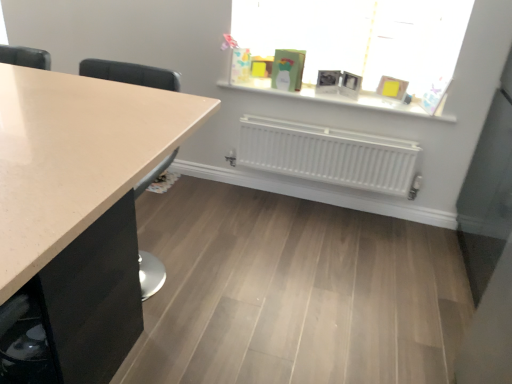
Question: Is white matte window sill at upper center not close to matte glass window at upper center?

Choices:
 (A) no
 (B) yes

Answer: (A)

Question: Can you confirm if white matte window sill at upper center is shorter than matte glass window at upper center?

Choices:
 (A) yes
 (B) no

Answer: (A)

Question: Can you confirm if white matte window sill at upper center is positioned to the left of matte glass window at upper center?

Choices:
 (A) yes
 (B) no

Answer: (A)

Question: From the image's perspective, would you say white matte window sill at upper center is positioned over matte glass window at upper center?

Choices:
 (A) yes
 (B) no

Answer: (B)

Question: Is the position of white matte window sill at upper center less distant than that of matte glass window at upper center?

Choices:
 (A) yes
 (B) no

Answer: (B)

Question: In terms of width, does white matte window sill at upper center look wider or thinner when compared to matte beige countertop at left?

Choices:
 (A) wide
 (B) thin

Answer: (B)

Question: Based on their sizes in the image, would you say white matte window sill at upper center is bigger or smaller than matte beige countertop at left?

Choices:
 (A) small
 (B) big

Answer: (A)

Question: Choose the correct answer: Is white matte window sill at upper center inside matte beige countertop at left or outside it?

Choices:
 (A) outside
 (B) inside

Answer: (A)

Question: From their relative heights in the image, would you say white matte window sill at upper center is taller or shorter than matte beige countertop at left?

Choices:
 (A) short
 (B) tall

Answer: (A)

Question: Relative to matte glass window at upper center, is matte beige countertop at left in front or behind?

Choices:
 (A) front
 (B) behind

Answer: (A)

Question: From the image's perspective, is matte beige countertop at left positioned above or below matte glass window at upper center?

Choices:
 (A) below
 (B) above

Answer: (A)

Question: From a real-world perspective, is matte beige countertop at left positioned above or below matte glass window at upper center?

Choices:
 (A) above
 (B) below

Answer: (B)

Question: From their relative heights in the image, would you say matte beige countertop at left is taller or shorter than matte glass window at upper center?

Choices:
 (A) tall
 (B) short

Answer: (A)

Question: Is matte glass window at upper center taller or shorter than white matte radiator at center?

Choices:
 (A) tall
 (B) short

Answer: (A)

Question: In terms of width, does matte glass window at upper center look wider or thinner when compared to white matte radiator at center?

Choices:
 (A) wide
 (B) thin

Answer: (A)